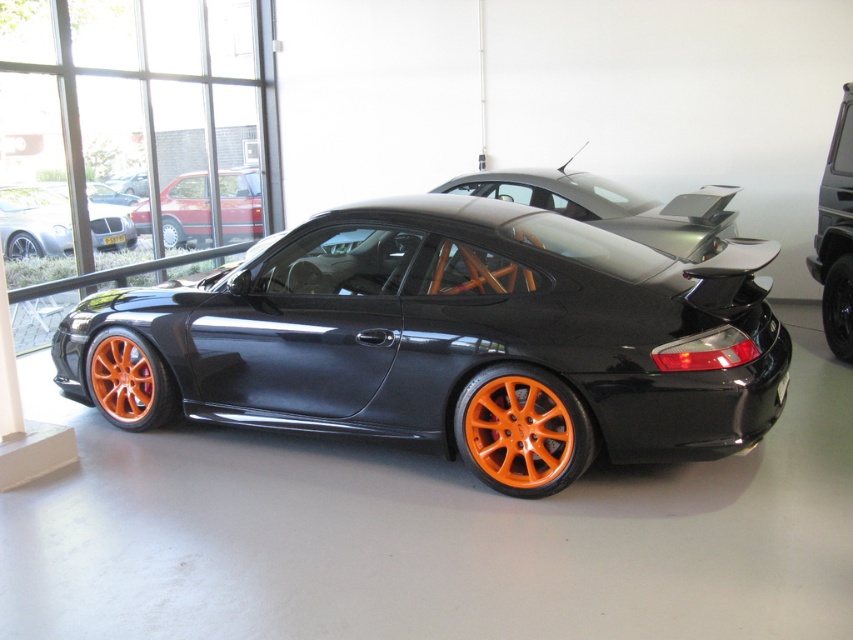
You are a delivery person trying to park a motorcycle that is 2 meters long in the same garage. There is a space between the matte black sports car at center and the orange matte wheel at center. Can the motorcycle fit in that space?

The distance between the matte black sports car at center and the orange matte wheel at center is 6.00 meters. Since the motorcycle is only 2 meters long, it can easily fit in the space between them.

You are a delivery person who needs to place a package between the matte orange wheels at center and the matte black car at left. The package requires 1.5 meters of space. Can you fit it there?

The distance between the matte orange wheels at center and the matte black car at left is 1.54 meters, which is sufficient to fit the package requiring 1.5 meters of space.